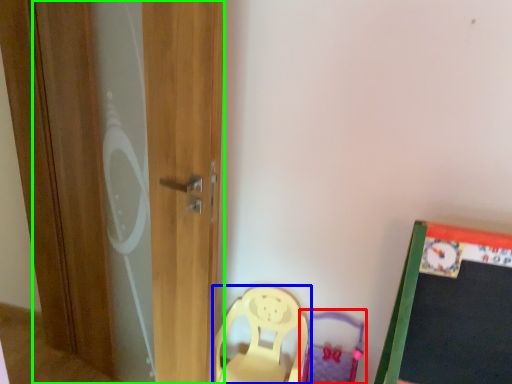
Question: Which object is the closest to the swivel chair (highlighted by a red box)? Choose among these: chair (highlighted by a blue box) or screen door (highlighted by a green box).

Choices:
 (A) chair
 (B) screen door

Answer: (A)